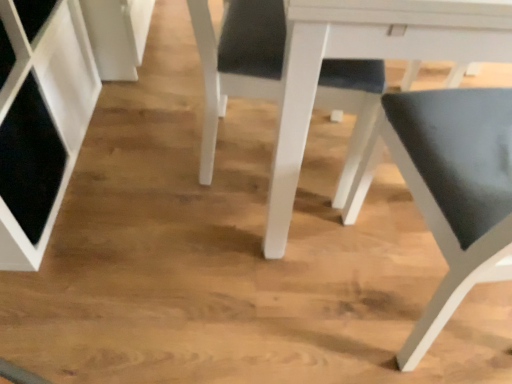
Question: Does point coord(201,43) appear closer or farther from the camera than point coord(462,56)?

Choices:
 (A) closer
 (B) farther

Answer: (B)

Question: Is matte black chair at center, arranged as the second chair when viewed from the right, wider or thinner than white glossy table at center?

Choices:
 (A) wide
 (B) thin

Answer: (B)

Question: Which object is the farthest from the white glossy table at center?

Choices:
 (A) matte black chair at center, the first chair positioned from the left
 (B) matte black chair at lower right, the second chair viewed from the left

Answer: (B)

Question: Estimate the real-world distances between objects in this image. Which object is closer to the matte black chair at center, arranged as the second chair when viewed from the right?

Choices:
 (A) matte black chair at lower right, which ranks as the first chair in right-to-left order
 (B) white glossy table at center

Answer: (B)